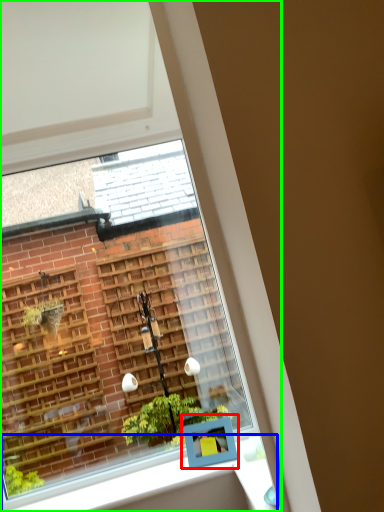
Question: Which object is the closest to the window box (highlighted by a red box)? Choose among these: window sill (highlighted by a blue box) or window (highlighted by a green box).

Choices:
 (A) window sill
 (B) window

Answer: (A)